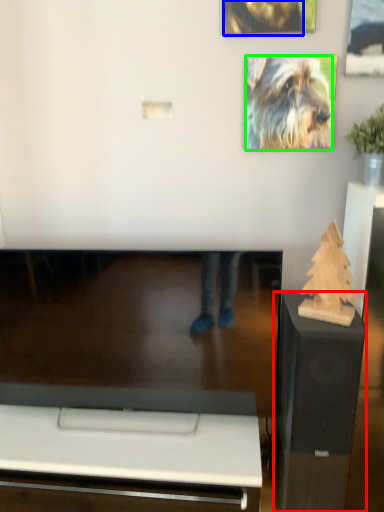
Question: Based on their relative distances, which object is farther from furniture (highlighted by a red box)? Choose from dog (highlighted by a blue box) and dog (highlighted by a green box).

Choices:
 (A) dog
 (B) dog

Answer: (A)